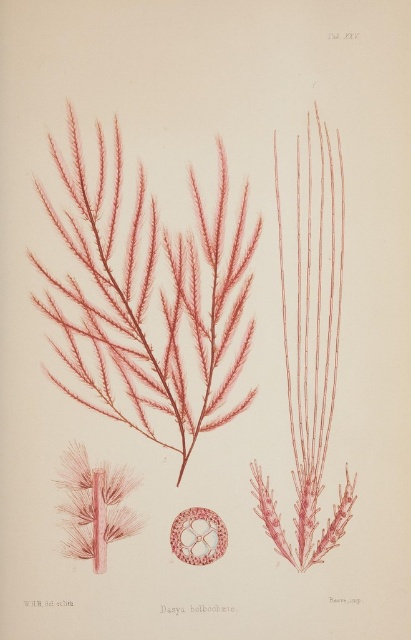
Is matte red seaweed at center taller than translucent pink filamentous structure at center?

Yes.

Who is higher up, matte red seaweed at center or translucent pink filamentous structure at center?

Positioned higher is matte red seaweed at center.

Is point (237, 300) closer to camera compared to point (196, 534)?

No, it is not.

The width and height of the screenshot is (411, 640). I want to click on matte red seaweed at center, so click(x=147, y=301).